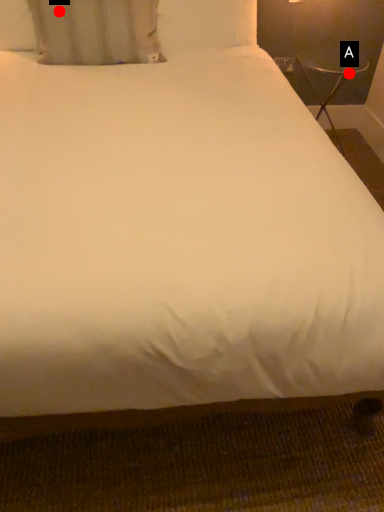
Question: Two points are circled on the image, labeled by A and B beside each circle. Which point is closer to the camera?

Choices:
 (A) A is closer
 (B) B is closer

Answer: (B)